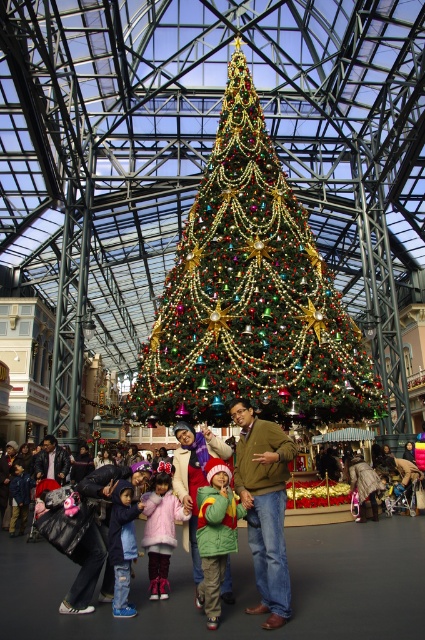
Question: Considering the real-world distances, which object is farthest from the matte green coat at center?

Choices:
 (A) fuzzy pink coat at center
 (B) green knitted sweater at center
 (C) denim jacket at lower left

Answer: (B)

Question: Which of the following is the farthest from the observer?

Choices:
 (A) green knitted sweater at center
 (B) matte blue jacket at lower left
 (C) iridescent gold christmas tree at center
 (D) denim jacket at lower left

Answer: (B)

Question: Which point appears closest to the camera in this image?

Choices:
 (A) tap(20, 541)
 (B) tap(119, 609)
 (C) tap(10, 492)

Answer: (B)

Question: Is green fuzzy coat at center wider than denim jacket at lower left?

Choices:
 (A) yes
 (B) no

Answer: (A)

Question: Can you confirm if iridescent gold christmas tree at center is bigger than matte blue jacket at lower left?

Choices:
 (A) yes
 (B) no

Answer: (A)

Question: Is matte green coat at center to the left of denim jacket at lower left from the viewer's perspective?

Choices:
 (A) yes
 (B) no

Answer: (B)